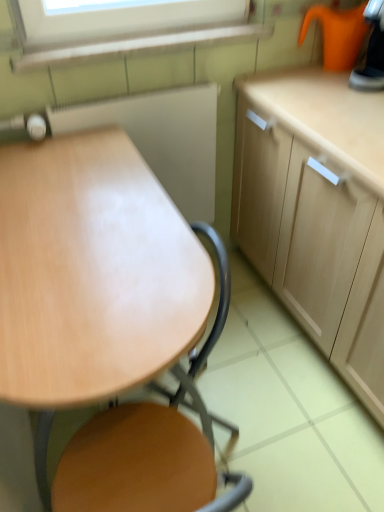
Question: Is orange plastic kettle at upper right, the 2th appliance from the left, taller than wooden board at center, the 2th appliance when ordered from top to bottom?

Choices:
 (A) no
 (B) yes

Answer: (A)

Question: Can you confirm if orange plastic kettle at upper right, the first appliance positioned from the right, is shorter than wooden board at center, the 1th appliance from the left?

Choices:
 (A) no
 (B) yes

Answer: (B)

Question: Is orange plastic kettle at upper right, positioned as the 1th appliance in top-to-bottom order, thinner than wooden board at center, which ranks as the second appliance in right-to-left order?

Choices:
 (A) no
 (B) yes

Answer: (A)

Question: Could you tell me if orange plastic kettle at upper right, the second appliance in the bottom-to-top sequence, is turned towards wooden board at center, the 1th appliance from the left?

Choices:
 (A) no
 (B) yes

Answer: (B)

Question: Considering the relative sizes of orange plastic kettle at upper right, the 2th appliance from the left, and wooden board at center, which ranks as the second appliance in right-to-left order, in the image provided, is orange plastic kettle at upper right, the 2th appliance from the left, smaller than wooden board at center, which ranks as the second appliance in right-to-left order,?

Choices:
 (A) no
 (B) yes

Answer: (B)

Question: Visually, is wooden at center positioned to the left or to the right of orange plastic kettle at upper right, the second appliance in the bottom-to-top sequence?

Choices:
 (A) left
 (B) right

Answer: (A)

Question: From a real-world perspective, is wooden at center physically located above or below orange plastic kettle at upper right, the second appliance in the bottom-to-top sequence?

Choices:
 (A) above
 (B) below

Answer: (B)

Question: From the image's perspective, is wooden at center positioned above or below orange plastic kettle at upper right, positioned as the 1th appliance in top-to-bottom order?

Choices:
 (A) above
 (B) below

Answer: (B)

Question: Considering the positions of wooden at center and orange plastic kettle at upper right, the second appliance in the bottom-to-top sequence, in the image, is wooden at center taller or shorter than orange plastic kettle at upper right, the second appliance in the bottom-to-top sequence,?

Choices:
 (A) short
 (B) tall

Answer: (B)

Question: Considering their positions, is light wood cabinet at right located in front of or behind wooden at center?

Choices:
 (A) front
 (B) behind

Answer: (A)

Question: In the image, is light wood cabinet at right on the left side or the right side of wooden at center?

Choices:
 (A) left
 (B) right

Answer: (B)

Question: From the image's perspective, relative to wooden at center, is light wood cabinet at right above or below?

Choices:
 (A) below
 (B) above

Answer: (B)

Question: Is point (316, 136) closer or farther from the camera than point (135, 419)?

Choices:
 (A) closer
 (B) farther

Answer: (B)

Question: Relative to wooden at center, is orange plastic kettle at upper right, the first appliance positioned from the right, in front or behind?

Choices:
 (A) behind
 (B) front

Answer: (A)

Question: Considering the positions of orange plastic kettle at upper right, the second appliance in the bottom-to-top sequence, and wooden at center in the image, is orange plastic kettle at upper right, the second appliance in the bottom-to-top sequence, bigger or smaller than wooden at center?

Choices:
 (A) small
 (B) big

Answer: (A)